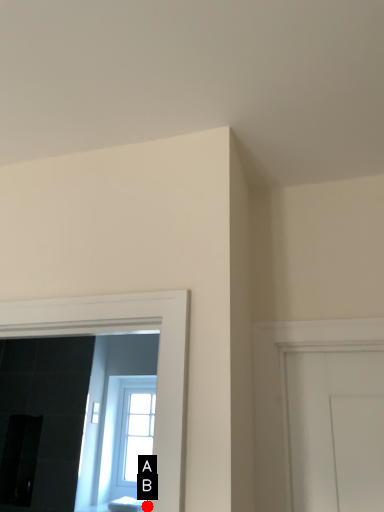
Question: Two points are circled on the image, labeled by A and B beside each circle. Which point is further to the camera?

Choices:
 (A) A is further
 (B) B is further

Answer: (A)